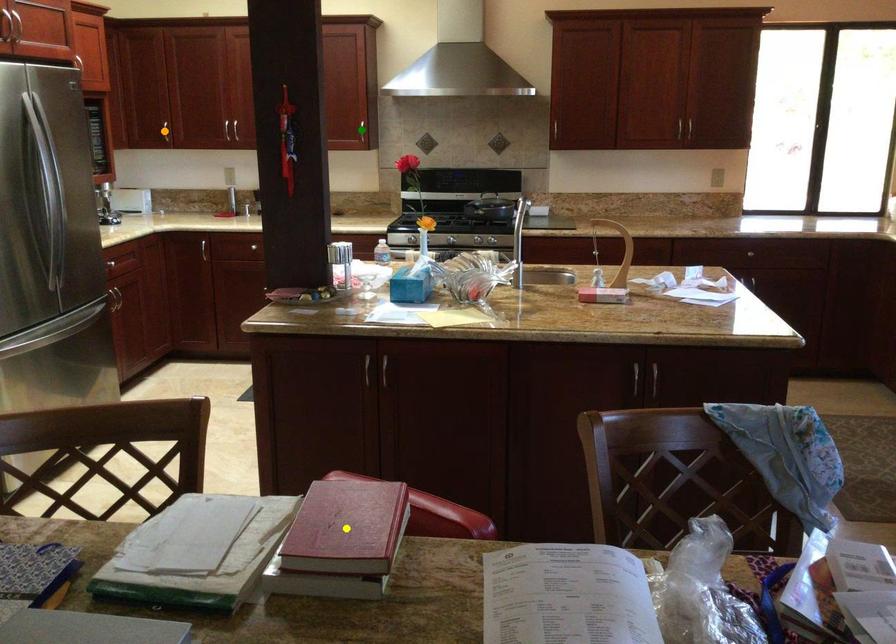
Order these from nearest to farthest:
1. green point
2. yellow point
3. orange point

yellow point, green point, orange point